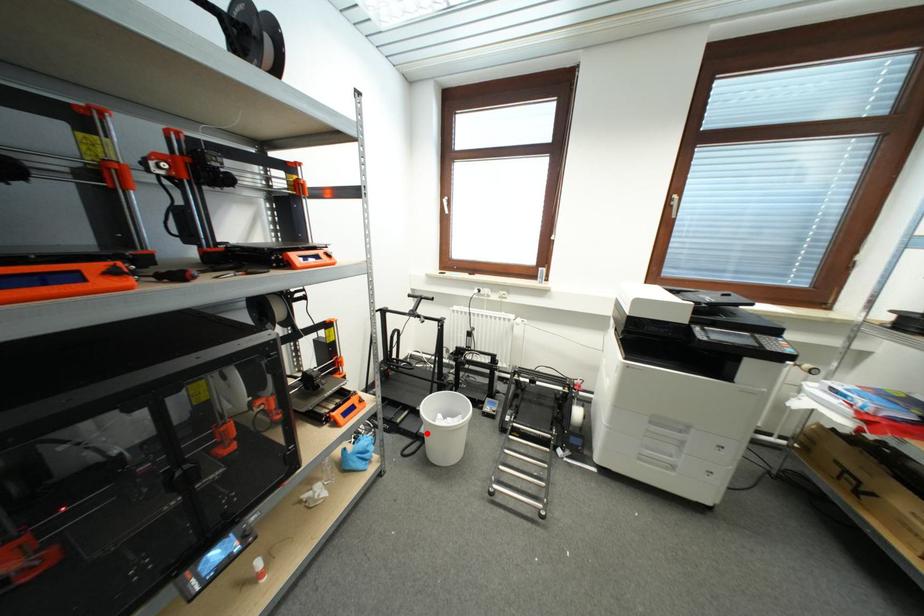
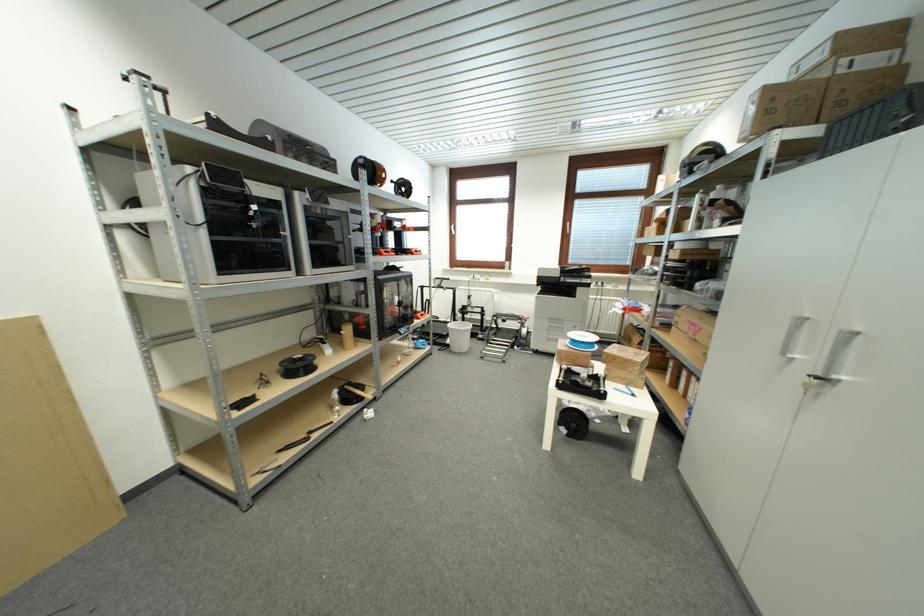
Locate, in the second image, the point that corresponds to the highlighted location in the first image.

(453, 344)